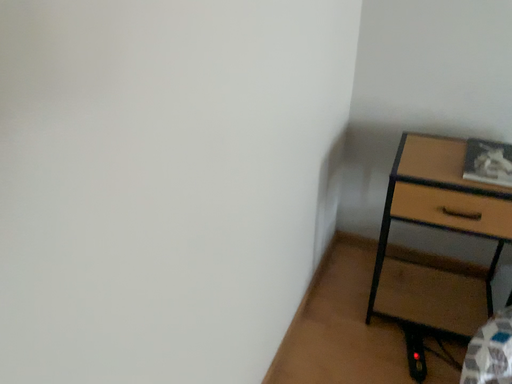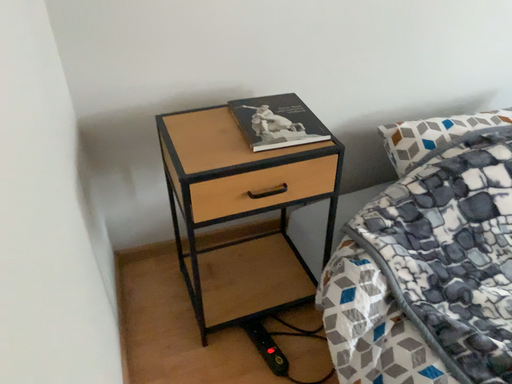
Question: How did the camera likely rotate when shooting the video?

Choices:
 (A) rotated left
 (B) rotated right

Answer: (B)